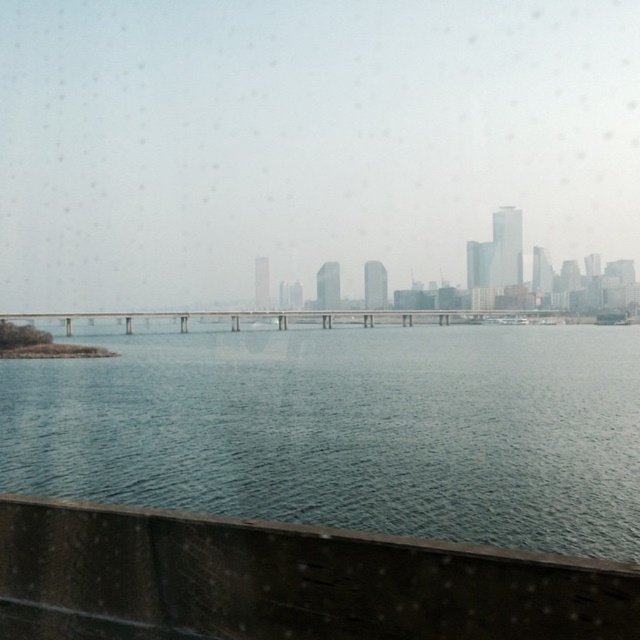
Question: Which object appears closest to the camera in this image?

Choices:
 (A) concrete bridge at center
 (B) blue water at center

Answer: (B)

Question: Is blue water at center closer to camera compared to concrete bridge at center?

Choices:
 (A) yes
 (B) no

Answer: (A)

Question: Does blue water at center have a greater width compared to concrete bridge at center?

Choices:
 (A) no
 (B) yes

Answer: (A)

Question: Can you confirm if blue water at center is smaller than concrete bridge at center?

Choices:
 (A) no
 (B) yes

Answer: (B)

Question: Among these points, which one is farthest from the camera?

Choices:
 (A) tap(628, 518)
 (B) tap(163, 321)

Answer: (B)